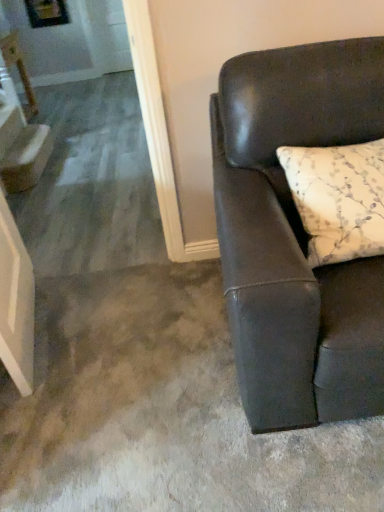
What do you see at coordinates (338, 199) in the screenshot? This screenshot has height=512, width=384. I see `white floral-patterned pillow at right` at bounding box center [338, 199].

Image resolution: width=384 pixels, height=512 pixels. What are the coordinates of `white glossy step at left` in the screenshot? It's located at (27, 158).

Identify the location of white floral-patterned pillow at right. This screenshot has width=384, height=512. (338, 199).

From a real-world perspective, relative to matte white table at upper left, is white glossy step at left vertically above or below?

Clearly, from a real-world perspective, white glossy step at left is below matte white table at upper left.

From the image's perspective, between white glossy step at left and matte white table at upper left, who is located below?

white glossy step at left appears lower in the image.

Between white glossy step at left and matte white table at upper left, which one is positioned behind?

matte white table at upper left.

In terms of size, does white glossy step at left appear bigger or smaller than matte white table at upper left?

Considering their sizes, white glossy step at left takes up less space than matte white table at upper left.

What's the angular difference between matte black couch at right and white glossy step at left's facing directions?

matte black couch at right and white glossy step at left are facing 87.9 degrees away from each other.

From the image's perspective, which is below, matte black couch at right or white glossy step at left?

From the image's view, matte black couch at right is below.

Based on the photo, is matte black couch at right not near white glossy step at left?

Yes, matte black couch at right is far from white glossy step at left.

Between white floral-patterned pillow at right and white glossy step at left, which one has more height?

Standing taller between the two is white floral-patterned pillow at right.

Could white glossy step at left be considered to be inside white floral-patterned pillow at right?

No, white glossy step at left is not a part of white floral-patterned pillow at right.

Based on the photo, can you confirm if white floral-patterned pillow at right is thinner than white glossy step at left?

No.

Considering the relative positions of white floral-patterned pillow at right and white glossy step at left in the image provided, is white floral-patterned pillow at right to the left of white glossy step at left from the viewer's perspective?

Incorrect, white floral-patterned pillow at right is not on the left side of white glossy step at left.

From the image's perspective, who appears lower, white glossy step at left or matte black couch at right?

matte black couch at right appears lower in the image.

Does white glossy step at left have a lesser width compared to matte black couch at right?

Correct, the width of white glossy step at left is less than that of matte black couch at right.

Considering the relative sizes of white glossy step at left and matte black couch at right in the image provided, is white glossy step at left shorter than matte black couch at right?

Yes.

Is matte black couch at right a part of white glossy step at left?

No.

Is matte black couch at right next to white floral-patterned pillow at right and touching it?

No, matte black couch at right is not making contact with white floral-patterned pillow at right.

Is matte black couch at right shorter than white floral-patterned pillow at right?

Incorrect, the height of matte black couch at right does not fall short of that of white floral-patterned pillow at right.

Based on their sizes in the image, would you say matte black couch at right is bigger or smaller than white floral-patterned pillow at right?

matte black couch at right is bigger than white floral-patterned pillow at right.

You are a GUI agent. You are given a task and a screenshot of the screen. Output one action in this format:
    pyautogui.click(x=<x>, y=<y>)
    Task: Click on the pillow to the left of matte black couch at right
    
    Given the screenshot: What is the action you would take?
    pyautogui.click(x=338, y=199)

In the scene shown: From a real-world perspective, is white floral-patterned pillow at right physically located above or below matte black couch at right?

From a real-world perspective, white floral-patterned pillow at right is physically above matte black couch at right.

Considering the relative sizes of white floral-patterned pillow at right and matte black couch at right in the image provided, is white floral-patterned pillow at right smaller than matte black couch at right?

Yes, white floral-patterned pillow at right is smaller than matte black couch at right.

In the scene shown: Considering the positions of objects matte white table at upper left and matte black couch at right in the image provided, who is more to the left, matte white table at upper left or matte black couch at right?

Positioned to the left is matte white table at upper left.

Can matte black couch at right be found inside matte white table at upper left?

No, matte black couch at right is not a part of matte white table at upper left.

Does matte white table at upper left come in front of matte black couch at right?

No.

From a real-world perspective, is matte white table at upper left positioned above or below matte black couch at right?

matte white table at upper left is situated lower than matte black couch at right in the real world.

This screenshot has width=384, height=512. Identify the location of table positioned vertically above the white glossy step at left (from a real-world perspective). (19, 70).

Locate an element on the screen. studio couch in front of the white glossy step at left is located at coordinates (296, 234).

From the image, which object appears to be farther from matte black couch at right, white floral-patterned pillow at right or white glossy step at left?

Among the two, white glossy step at left is located further to matte black couch at right.

Based on the photo, when comparing their distances from white floral-patterned pillow at right, does white glossy step at left or matte white table at upper left seem further?

Based on the image, matte white table at upper left appears to be further to white floral-patterned pillow at right.

Which object lies further to the anchor point white floral-patterned pillow at right, matte white table at upper left or white glossy step at left?

Among the two, matte white table at upper left is located further to white floral-patterned pillow at right.

Based on their spatial positions, is matte black couch at right or matte white table at upper left further from white floral-patterned pillow at right?

The object further to white floral-patterned pillow at right is matte white table at upper left.

From the image, which object appears to be farther from white glossy step at left, matte white table at upper left or white floral-patterned pillow at right?

Among the two, white floral-patterned pillow at right is located further to white glossy step at left.

Looking at the image, which one is located closer to white glossy step at left, matte black couch at right or white floral-patterned pillow at right?

The object closer to white glossy step at left is matte black couch at right.

Estimate the real-world distances between objects in this image. Which object is closer to matte white table at upper left, white glossy step at left or white floral-patterned pillow at right?

white glossy step at left.

Considering their positions, is matte white table at upper left positioned further to matte black couch at right than white glossy step at left?

matte white table at upper left lies further to matte black couch at right than the other object.

Locate an element on the screen. The width and height of the screenshot is (384, 512). stairwell positioned between white floral-patterned pillow at right and matte white table at upper left from near to far is located at coordinates (27, 158).

Identify the location of pillow between matte black couch at right and matte white table at upper left from front to back. (338, 199).

At what (x,y) coordinates should I click in order to perform the action: click on stairwell located between matte black couch at right and matte white table at upper left in the depth direction. Please return your answer as a coordinate pair (x, y). Image resolution: width=384 pixels, height=512 pixels. Looking at the image, I should click on (27, 158).

Where is `pillow between matte black couch at right and white glossy step at left from front to back`? The width and height of the screenshot is (384, 512). pillow between matte black couch at right and white glossy step at left from front to back is located at coordinates (338, 199).